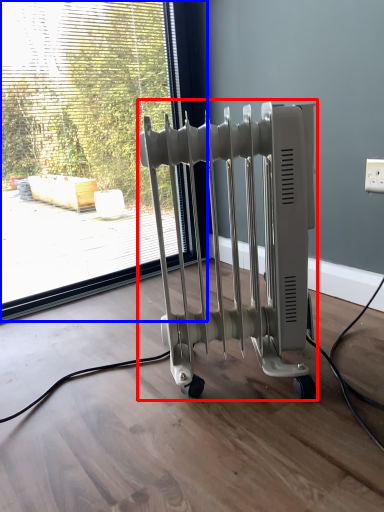
Question: Which of the following is the farthest to the observer, bath heater (highlighted by a red box) or window (highlighted by a blue box)?

Choices:
 (A) bath heater
 (B) window

Answer: (B)